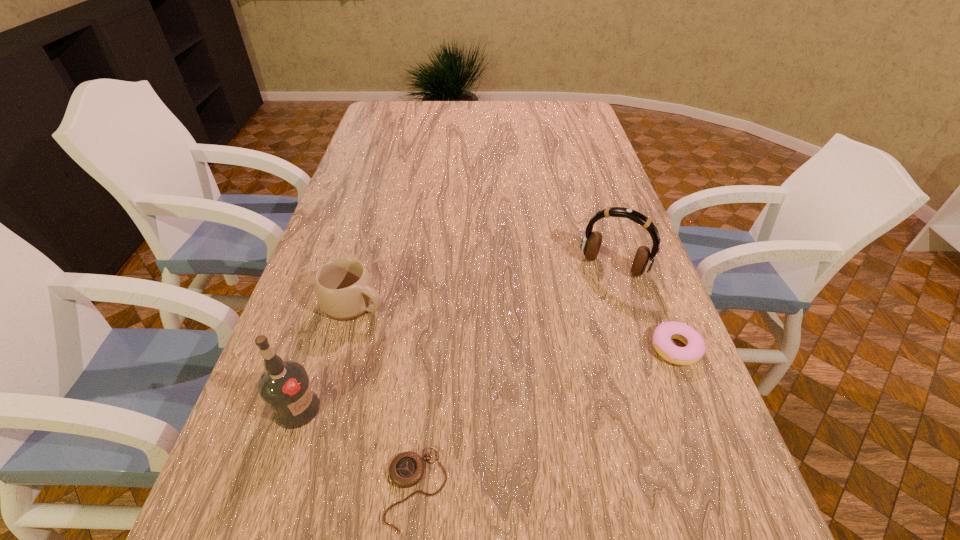
At what (x,y) coordinates should I click in order to perform the action: click on vacant space located on the ear cup of the second tallest object. Please return your answer as a coordinate pair (x, y). The width and height of the screenshot is (960, 540). Looking at the image, I should click on (546, 390).

Where is `object present at the near edge`? The width and height of the screenshot is (960, 540). object present at the near edge is located at coordinates (406, 469).

I want to click on mug present at the left edge, so click(344, 289).

Identify the location of vodka present at the left edge. The image size is (960, 540). (285, 387).

Identify the location of doughnut that is at the right edge. (694, 349).

Locate an element on the screen. Image resolution: width=960 pixels, height=540 pixels. headset that is at the right edge is located at coordinates (590, 245).

Locate an element on the screen. The width and height of the screenshot is (960, 540). vacant space at the far edge is located at coordinates (438, 117).

Where is `vacant space at the near edge of the desktop`? vacant space at the near edge of the desktop is located at coordinates (432, 476).

What are the coordinates of `vacant area at the left edge` in the screenshot? It's located at (305, 342).

Identify the location of free space at the right edge of the desktop. (628, 265).